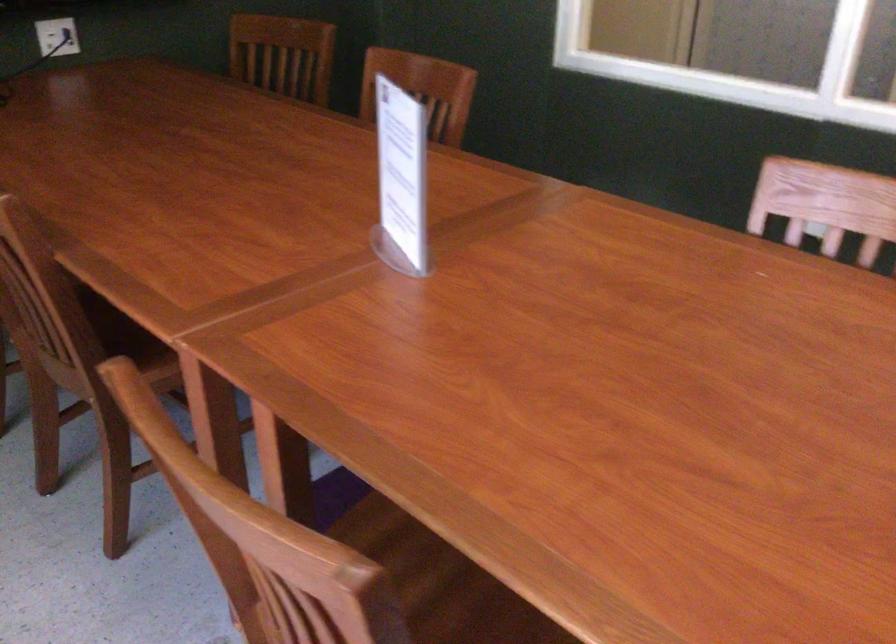
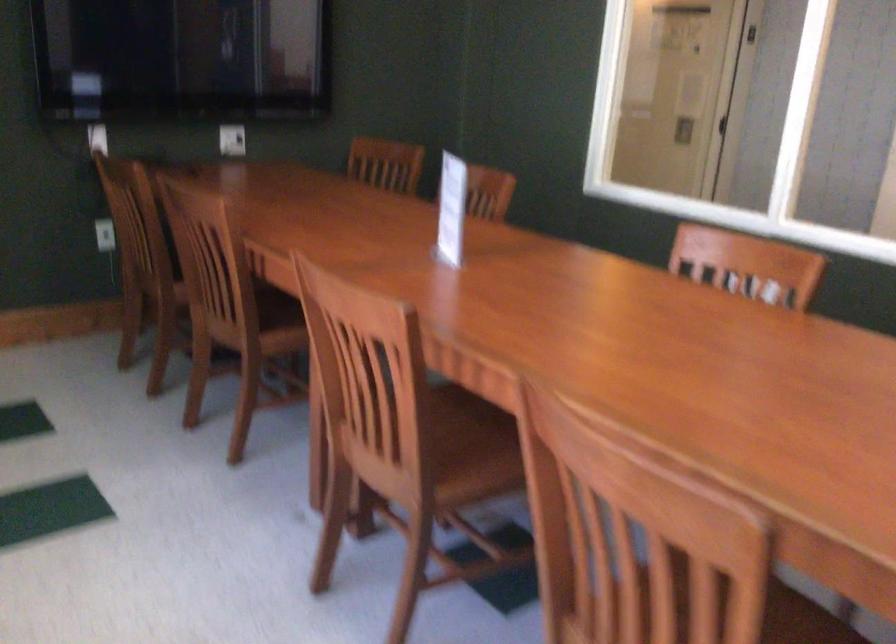
Locate, in the second image, the point that corresponds to (71,339) in the first image.

(239, 303)